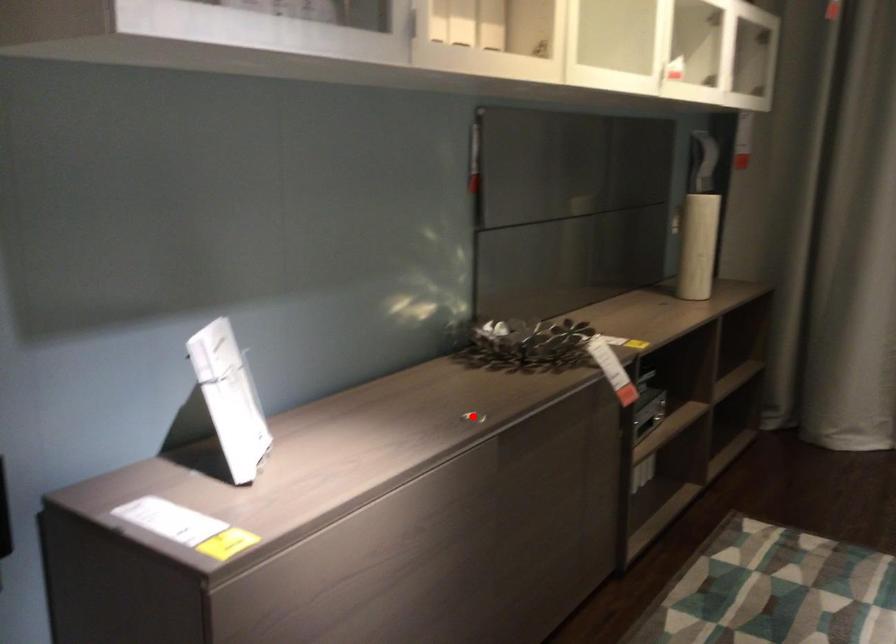
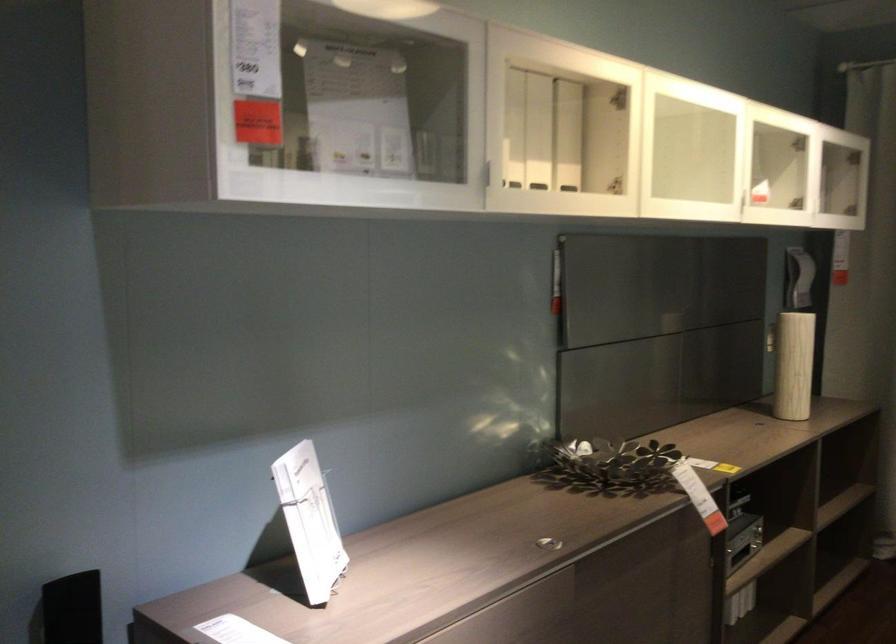
Find the pixel in the second image that matches the highlighted location in the first image.

(547, 543)